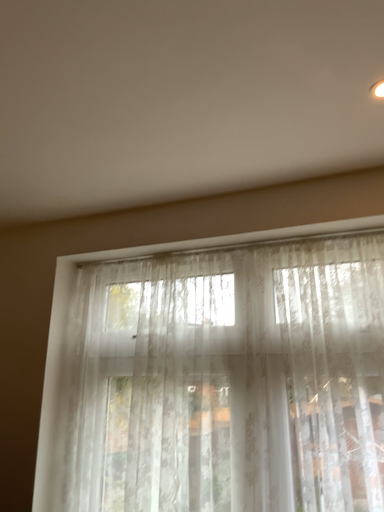
Question: From the image's perspective, is translucent lace curtain at center located above white sheer curtains at lower center?

Choices:
 (A) yes
 (B) no

Answer: (B)

Question: Is translucent lace curtain at center to the left of white sheer curtains at lower center from the viewer's perspective?

Choices:
 (A) no
 (B) yes

Answer: (A)

Question: Is translucent lace curtain at center completely or partially outside of white sheer curtains at lower center?

Choices:
 (A) no
 (B) yes

Answer: (B)

Question: Is translucent lace curtain at center at the right side of white sheer curtains at lower center?

Choices:
 (A) yes
 (B) no

Answer: (A)

Question: Is translucent lace curtain at center beside white sheer curtains at lower center?

Choices:
 (A) no
 (B) yes

Answer: (A)

Question: Is translucent lace curtain at center further to the viewer compared to white sheer curtains at lower center?

Choices:
 (A) no
 (B) yes

Answer: (B)

Question: Is white sheer curtains at lower center positioned with its back to translucent lace curtain at center?

Choices:
 (A) no
 (B) yes

Answer: (A)

Question: From a real-world perspective, is white sheer curtains at lower center on translucent lace curtain at center?

Choices:
 (A) yes
 (B) no

Answer: (A)

Question: From the image's perspective, is white sheer curtains at lower center located above translucent lace curtain at center?

Choices:
 (A) no
 (B) yes

Answer: (B)

Question: Is white sheer curtains at lower center further to the viewer compared to translucent lace curtain at center?

Choices:
 (A) no
 (B) yes

Answer: (A)

Question: Is white sheer curtains at lower center aimed at translucent lace curtain at center?

Choices:
 (A) yes
 (B) no

Answer: (B)

Question: Can you confirm if white sheer curtains at lower center is smaller than translucent lace curtain at center?

Choices:
 (A) no
 (B) yes

Answer: (A)

Question: Is translucent lace curtain at center wider or thinner than white sheer curtains at lower center?

Choices:
 (A) wide
 (B) thin

Answer: (B)